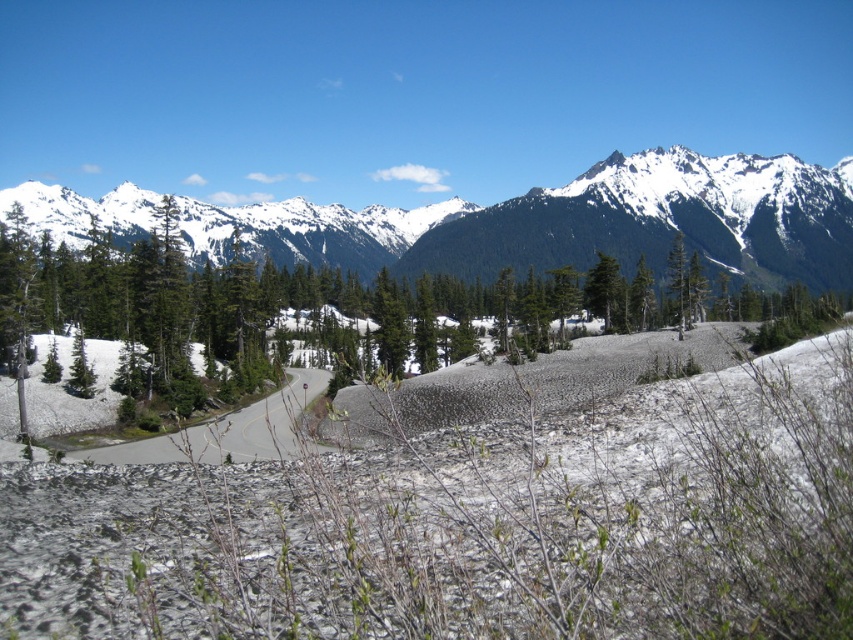
You are a hiker planning to take a photo of the green textured pine at center and the snowy granite mountains at upper center. Which object will appear larger in your photo?

The green textured pine at center will appear smaller in the photo compared to the snowy granite mountains at upper center because it has a smaller size.

You are a hiker planning to travel from point A to point B in the mountainous landscape. Point A is at coordinates point [279,211] and point B is at coordinates point [187,426]. Given that you want to take the path closest to you, which point should you start from?

Since point [279,211] is closer to the viewer than point [187,426], you should start from point [279,211] to take the path closest to you.

From the picture: You are a hiker trying to follow the asphalt road at center. You see a green textured pine at center. Which direction should you walk to stay on the road?

The green textured pine at center is positioned on the left side of the asphalt road at center. To stay on the road, you should walk to the right of the green textured pine at center.